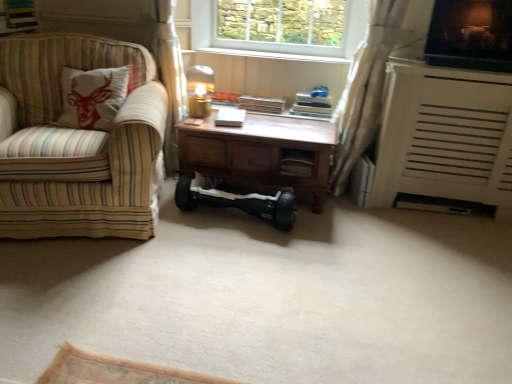
Identify the location of free space in front of white textured heater at right. point(455,245).